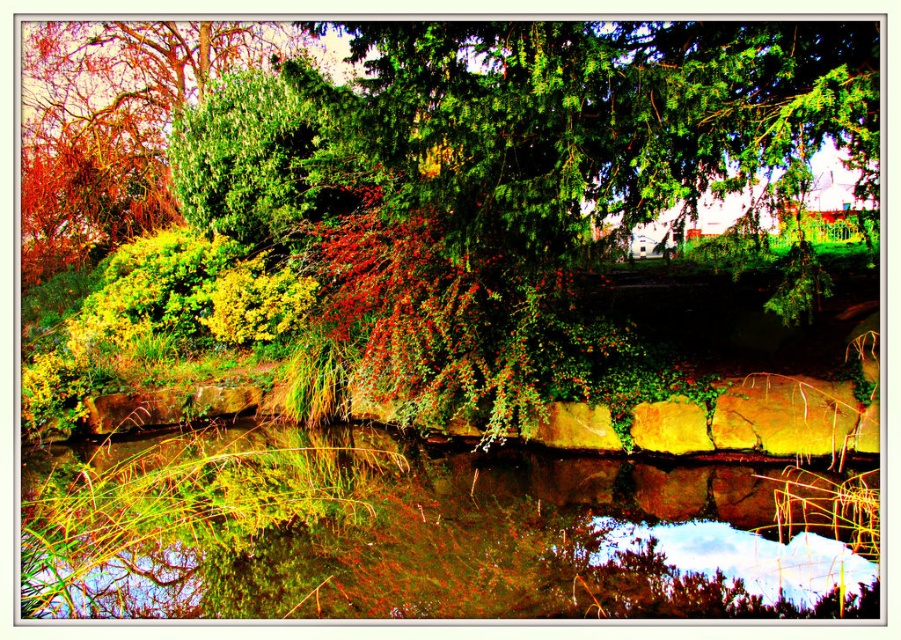
Is green leafy tree at upper center to the left of green mossy water at center from the viewer's perspective?

Yes, green leafy tree at upper center is to the left of green mossy water at center.

Is green leafy tree at upper center positioned before green mossy water at center?

Yes.

Locate an element on the screen. This screenshot has height=640, width=901. green leafy tree at upper center is located at coordinates (457, 216).